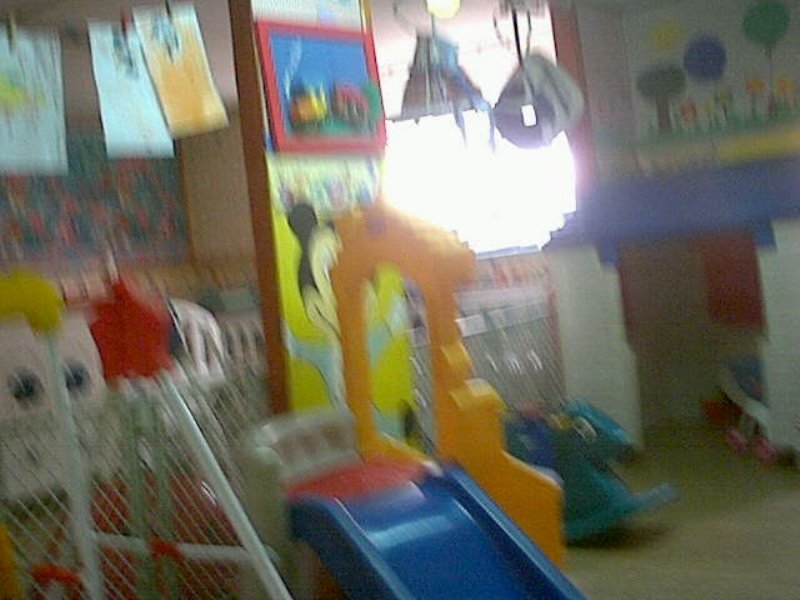
Where is `floor`? The image size is (800, 600). floor is located at coordinates (724, 546).